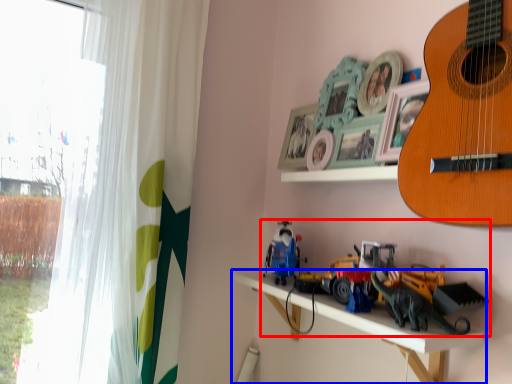
Question: Among these objects, which one is nearest to the camera, toy (highlighted by a red box) or shelf (highlighted by a blue box)?

Choices:
 (A) toy
 (B) shelf

Answer: (B)